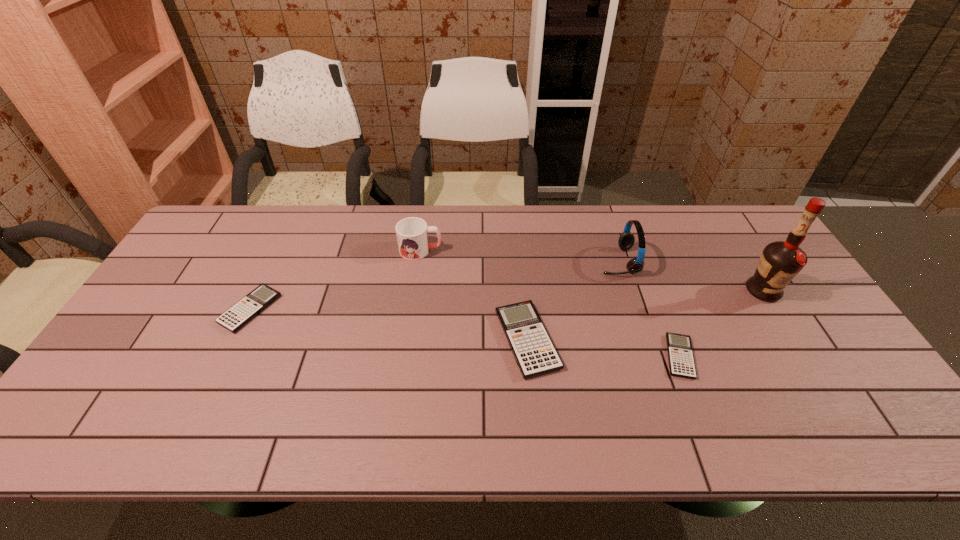
Locate an element on the screen. the fifth tallest object is located at coordinates tap(237, 316).

What are the coordinates of `the leftmost object` in the screenshot? It's located at (237, 316).

The width and height of the screenshot is (960, 540). Identify the location of the second calculator from left to right. (534, 352).

Where is `the third object from left to right`? the third object from left to right is located at coordinates [534, 352].

Identify the location of the shortest object. (680, 353).

Identify the location of the rightmost calculator. Image resolution: width=960 pixels, height=540 pixels. (680, 353).

You are a GUI agent. You are given a task and a screenshot of the screen. Output one action in this format:
    pyautogui.click(x=<x>, y=<y>)
    Task: Click on the fourth shortest object
    
    Given the screenshot: What is the action you would take?
    pyautogui.click(x=412, y=233)

Identify the location of mug. (412, 233).

At what (x,y) coordinates should I click in order to perform the action: click on the tallest object. Please return your answer as a coordinate pair (x, y). Looking at the image, I should click on (780, 261).

I want to click on the rightmost object, so click(x=780, y=261).